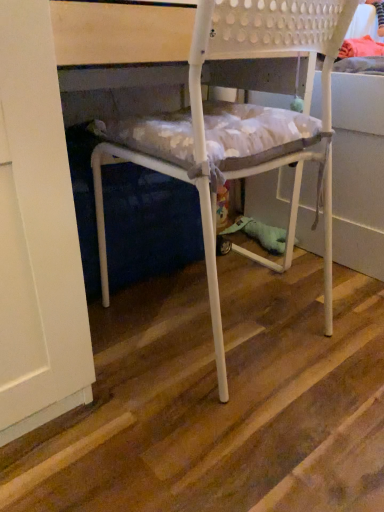
Question: From the image's perspective, is wooden at center located beneath white matte plastic chair at center?

Choices:
 (A) yes
 (B) no

Answer: (A)

Question: Is wooden at center wider than white matte plastic chair at center?

Choices:
 (A) yes
 (B) no

Answer: (A)

Question: Is wooden at center to the right of white matte plastic chair at center from the viewer's perspective?

Choices:
 (A) no
 (B) yes

Answer: (B)

Question: Considering the relative positions of wooden at center and white matte plastic chair at center in the image provided, is wooden at center to the left of white matte plastic chair at center from the viewer's perspective?

Choices:
 (A) yes
 (B) no

Answer: (B)

Question: Does wooden at center lie in front of white matte plastic chair at center?

Choices:
 (A) no
 (B) yes

Answer: (B)

Question: Is wooden at center further to camera compared to white matte plastic chair at center?

Choices:
 (A) yes
 (B) no

Answer: (B)

Question: Considering the relative positions of white matte plastic chair at center and wooden at center in the image provided, is white matte plastic chair at center to the left of wooden at center from the viewer's perspective?

Choices:
 (A) yes
 (B) no

Answer: (A)

Question: Are white matte plastic chair at center and wooden at center beside each other?

Choices:
 (A) no
 (B) yes

Answer: (A)

Question: Is white matte plastic chair at center outside wooden at center?

Choices:
 (A) yes
 (B) no

Answer: (A)

Question: Considering the relative positions of white matte plastic chair at center and wooden at center in the image provided, is white matte plastic chair at center to the right of wooden at center from the viewer's perspective?

Choices:
 (A) no
 (B) yes

Answer: (A)

Question: Considering the relative sizes of white matte plastic chair at center and wooden at center in the image provided, is white matte plastic chair at center shorter than wooden at center?

Choices:
 (A) yes
 (B) no

Answer: (B)

Question: Is white matte plastic chair at center thinner than wooden at center?

Choices:
 (A) yes
 (B) no

Answer: (A)

Question: Visually, is wooden at center positioned to the left or to the right of white matte plastic chair at center?

Choices:
 (A) right
 (B) left

Answer: (A)